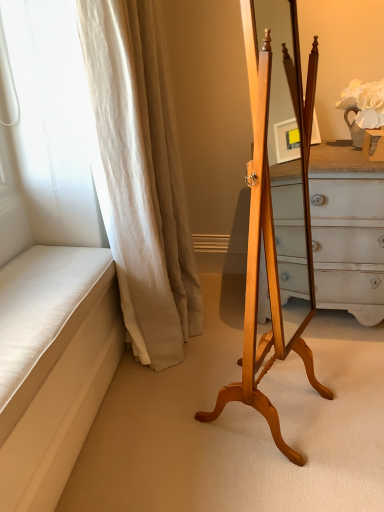
Question: Relative to white fabric curtain at left, is light wood easel at center in front or behind?

Choices:
 (A) behind
 (B) front

Answer: (B)

Question: Is light wood easel at center inside the boundaries of white fabric curtain at left, or outside?

Choices:
 (A) outside
 (B) inside

Answer: (A)

Question: From the image's perspective, is light wood easel at center positioned above or below white fabric curtain at left?

Choices:
 (A) above
 (B) below

Answer: (B)

Question: From a real-world perspective, is white fabric curtain at left physically located above or below light wood easel at center?

Choices:
 (A) above
 (B) below

Answer: (A)

Question: Based on their positions, is white fabric curtain at left located to the left or right of light wood easel at center?

Choices:
 (A) left
 (B) right

Answer: (A)

Question: Based on their sizes in the image, would you say white fabric curtain at left is bigger or smaller than light wood easel at center?

Choices:
 (A) small
 (B) big

Answer: (B)

Question: Is white fabric curtain at left wider or thinner than light wood easel at center?

Choices:
 (A) wide
 (B) thin

Answer: (A)